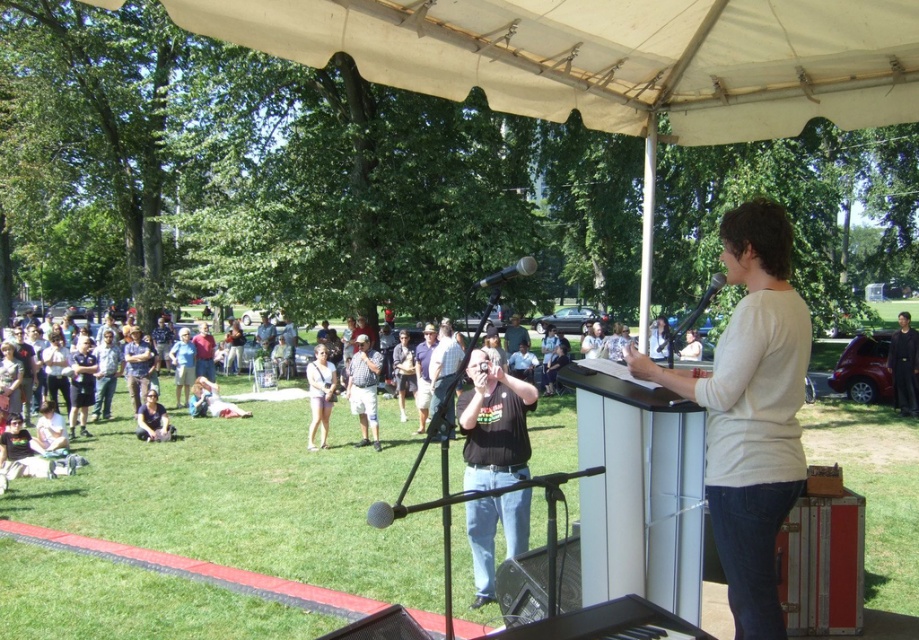
Can you confirm if metallic silver speaker at lower center is smaller than plaid fabric shirt at center?

Yes, metallic silver speaker at lower center is smaller than plaid fabric shirt at center.

Which is behind, point (542, 557) or point (441, 381)?

The point (441, 381) is behind.

Looking at this image, who is more distant from viewer, (557, 602) or (437, 368)?

Point (437, 368)

Identify the location of metallic silver speaker at lower center. Image resolution: width=919 pixels, height=640 pixels. (522, 586).

Which is behind, point (526, 552) or point (507, 340)?

The point (507, 340) is more distant.

Is metallic silver speaker at lower center shorter than dark gray shirt at center?

Correct, metallic silver speaker at lower center is not as tall as dark gray shirt at center.

Who is more distant from viewer, (558, 611) or (515, 326)?

The point (515, 326) is behind.

Locate an element on the screen. Image resolution: width=919 pixels, height=640 pixels. metallic silver speaker at lower center is located at coordinates (522, 586).

Is plaid fabric shirt at center above metallic silver microphone at center?

Actually, plaid fabric shirt at center is below metallic silver microphone at center.

Is point (440, 358) closer to camera compared to point (509, 275)?

That is False.

Which is in front, point (448, 403) or point (501, 276)?

Positioned in front is point (501, 276).

Image resolution: width=919 pixels, height=640 pixels. Identify the location of plaid fabric shirt at center. (443, 364).